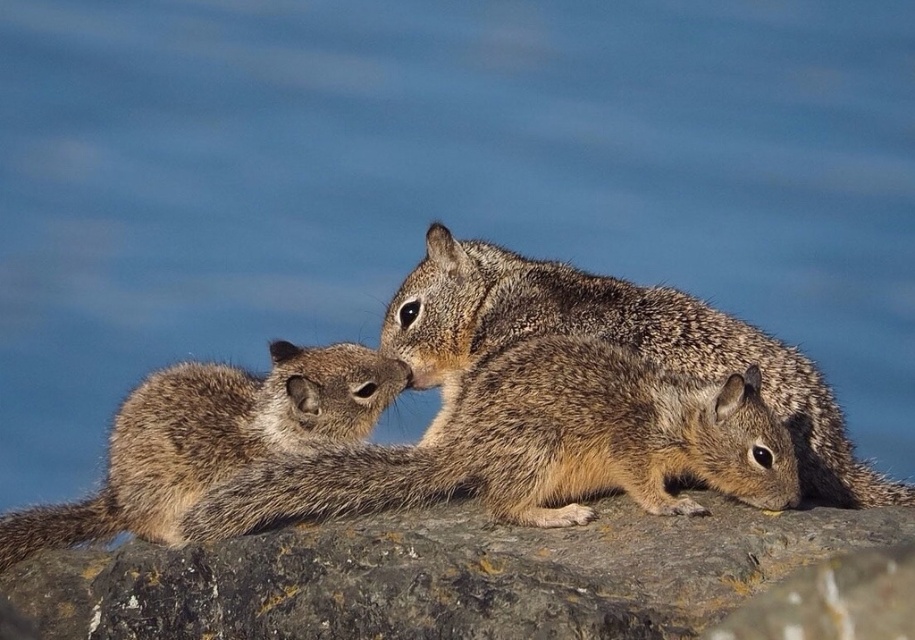
Question: Where is brown rough rock at center located in relation to fuzzy brown squirrel at center in the image?

Choices:
 (A) above
 (B) below

Answer: (B)

Question: Which point is farther from the camera taking this photo?

Choices:
 (A) (455, 634)
 (B) (373, 394)
 (C) (616, 326)
 (D) (601, 424)

Answer: (C)

Question: From the image, what is the correct spatial relationship of brown rough rock at center in relation to fuzzy brown squirrel at center?

Choices:
 (A) left
 (B) right

Answer: (A)

Question: Which of the following is the farthest from the observer?

Choices:
 (A) (466, 384)
 (B) (845, 486)
 (C) (81, 541)

Answer: (C)

Question: Which object is farther from the camera taking this photo?

Choices:
 (A) brown speckled squirrel at left
 (B) brown rough rock at center
 (C) brown furry squirrel at center
 (D) fuzzy brown squirrel at center

Answer: (D)

Question: Is fuzzy brown squirrel at center below brown speckled squirrel at left?

Choices:
 (A) no
 (B) yes

Answer: (A)